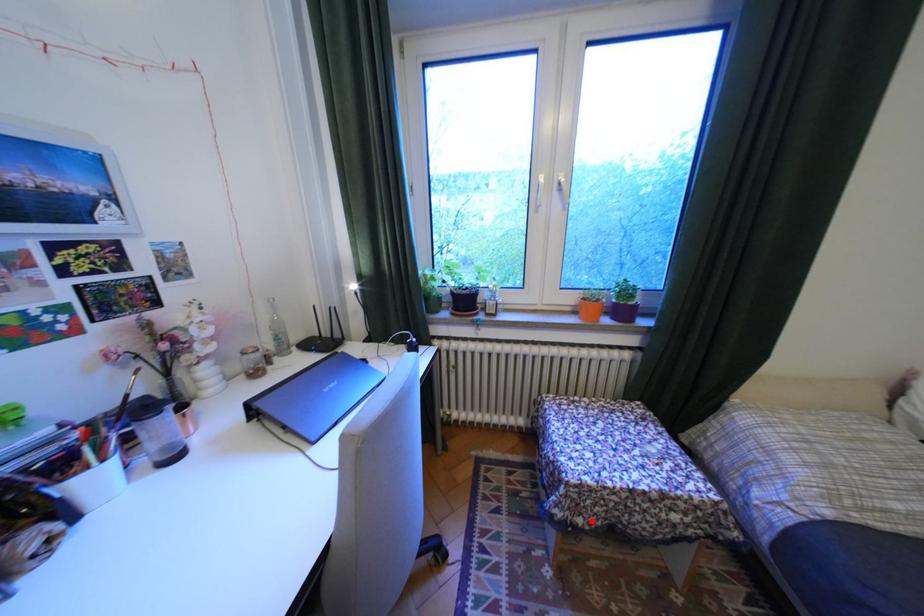
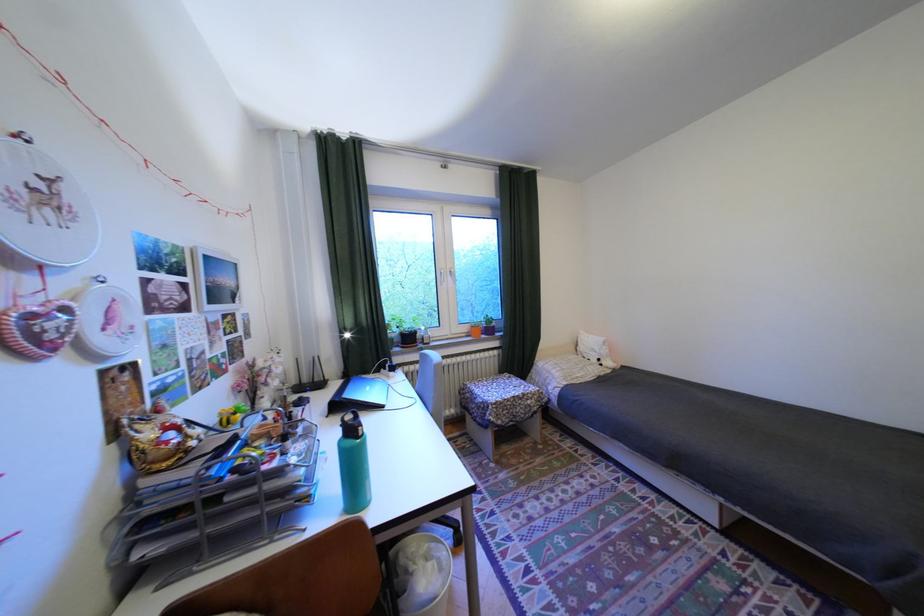
Question: A red point is marked in image1. In image2, is the corresponding 3D point closer to the camera or farther? Reply with the corresponding letter.

Choices:
 (A) The corresponding 3D point is closer.
 (B) The corresponding 3D point is farther.

Answer: (B)